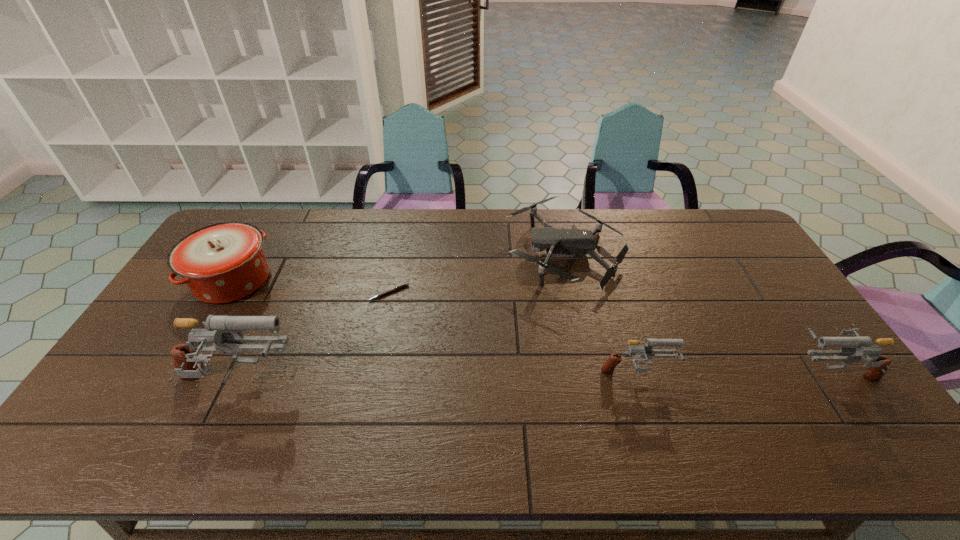
Identify the location of vacant space located at the barrel end of the tallest object. (382, 383).

This screenshot has height=540, width=960. Identify the location of vacant space located at the barrel end of the shortest gun. (791, 375).

Identify the location of vacant space located 0.390m at the barrel end of the second shortest gun. Image resolution: width=960 pixels, height=540 pixels. (644, 372).

What are the coordinates of `vacant space located at the barrel end of the second shortest gun` in the screenshot? It's located at (685, 372).

The height and width of the screenshot is (540, 960). Identify the location of vacant region located at the barrel end of the second shortest gun. (659, 372).

Where is `vacant area situated on the front-facing side of the fifth tallest object`? vacant area situated on the front-facing side of the fifth tallest object is located at coordinates (454, 254).

You are a GUI agent. You are given a task and a screenshot of the screen. Output one action in this format:
    pyautogui.click(x=<x>, y=<y>)
    Task: Click on the free space located on the front-facing side of the fifth tallest object
    This screenshot has height=540, width=960.
    Given the screenshot: What is the action you would take?
    pyautogui.click(x=405, y=254)

The image size is (960, 540). Find the location of `free space located on the front-facing side of the fifth tallest object`. free space located on the front-facing side of the fifth tallest object is located at coordinates (463, 254).

Find the location of a particular element. The height and width of the screenshot is (540, 960). vacant space located on the back of the casserole is located at coordinates (261, 233).

Locate an element on the screen. The width and height of the screenshot is (960, 540). vacant space located 0.360m at the nib of the fourth object from right to left is located at coordinates (365, 406).